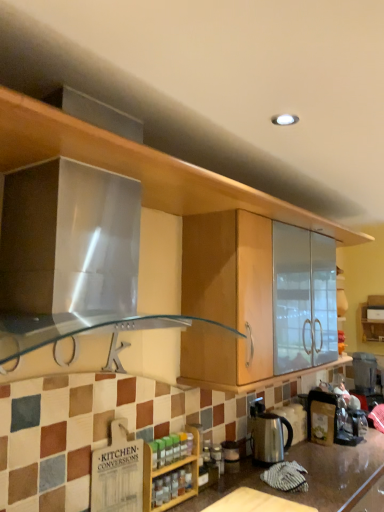
Question: Is polished stainless steel kettle at center at the left side of wooden cutting board at lower center?

Choices:
 (A) no
 (B) yes

Answer: (A)

Question: Is polished stainless steel kettle at center oriented away from wooden cutting board at lower center?

Choices:
 (A) no
 (B) yes

Answer: (A)

Question: Considering the relative sizes of polished stainless steel kettle at center and wooden cutting board at lower center in the image provided, is polished stainless steel kettle at center taller than wooden cutting board at lower center?

Choices:
 (A) no
 (B) yes

Answer: (B)

Question: Can you confirm if polished stainless steel kettle at center is wider than wooden cutting board at lower center?

Choices:
 (A) no
 (B) yes

Answer: (A)

Question: Is polished stainless steel kettle at center smaller than wooden cutting board at lower center?

Choices:
 (A) no
 (B) yes

Answer: (A)

Question: Which is correct: polished stainless steel kettle at center is inside wooden spice rack at lower center, or outside of it?

Choices:
 (A) outside
 (B) inside

Answer: (A)

Question: Considering their positions, is polished stainless steel kettle at center located in front of or behind wooden spice rack at lower center?

Choices:
 (A) behind
 (B) front

Answer: (A)

Question: From a real-world perspective, relative to wooden spice rack at lower center, is polished stainless steel kettle at center vertically above or below?

Choices:
 (A) above
 (B) below

Answer: (B)

Question: Based on their sizes in the image, would you say polished stainless steel kettle at center is bigger or smaller than wooden spice rack at lower center?

Choices:
 (A) small
 (B) big

Answer: (B)

Question: From the image's perspective, is wooden spice rack at lower center above or below polished stainless steel kettle at center?

Choices:
 (A) above
 (B) below

Answer: (A)

Question: Is wooden spice rack at lower center bigger or smaller than polished stainless steel kettle at center?

Choices:
 (A) big
 (B) small

Answer: (B)

Question: Is wooden spice rack at lower center taller or shorter than polished stainless steel kettle at center?

Choices:
 (A) tall
 (B) short

Answer: (A)

Question: From a real-world perspective, relative to polished stainless steel kettle at center, is wooden spice rack at lower center vertically above or below?

Choices:
 (A) above
 (B) below

Answer: (A)

Question: Is wooden cutting board at lower center inside the boundaries of wooden spice rack at lower center, or outside?

Choices:
 (A) inside
 (B) outside

Answer: (B)

Question: In terms of height, does wooden cutting board at lower center look taller or shorter compared to wooden spice rack at lower center?

Choices:
 (A) short
 (B) tall

Answer: (A)